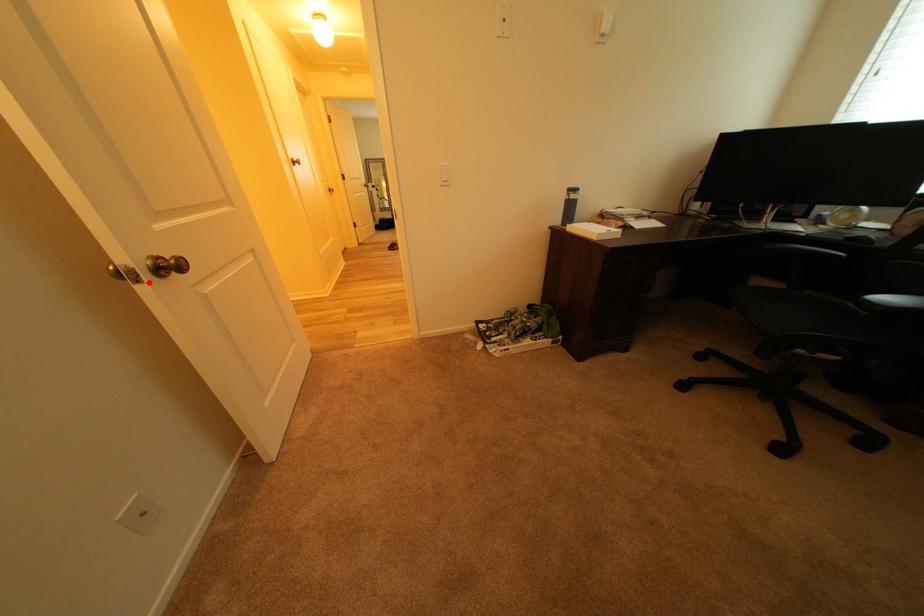
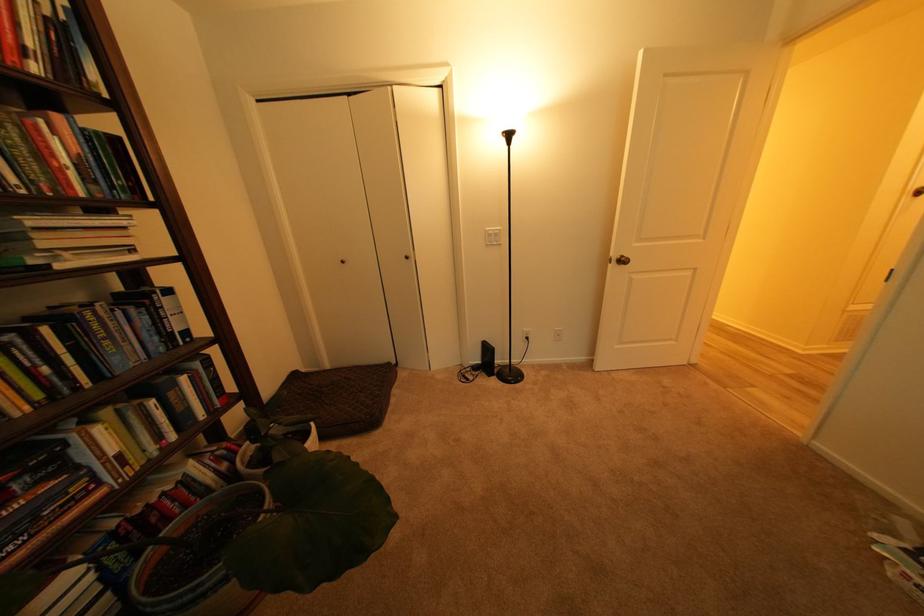
Where in the second image is the point corresponding to the highlighted location from the first image?

(621, 265)